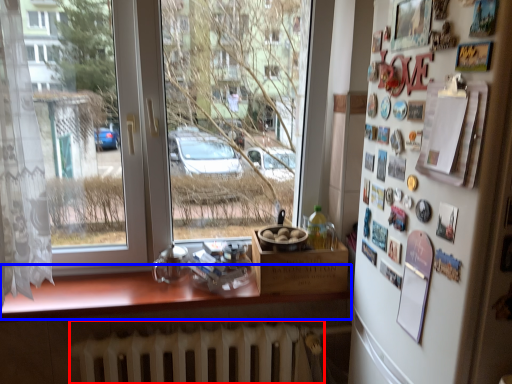
Question: Which object is closer to the camera taking this photo, radiator (highlighted by a red box) or counter top (highlighted by a blue box)?

Choices:
 (A) radiator
 (B) counter top

Answer: (B)